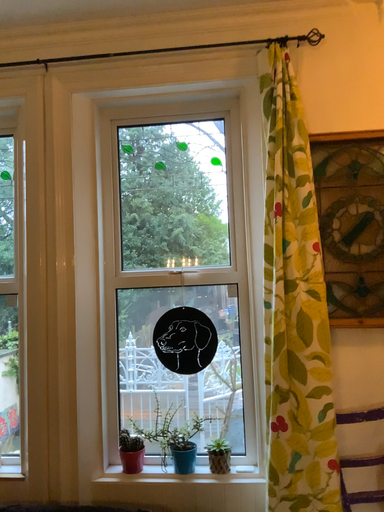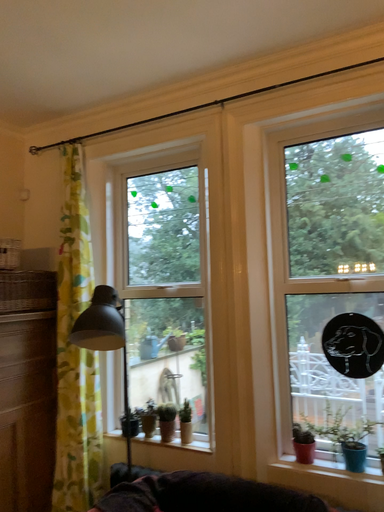
Question: How did the camera likely rotate when shooting the video?

Choices:
 (A) rotated right
 (B) rotated left

Answer: (B)